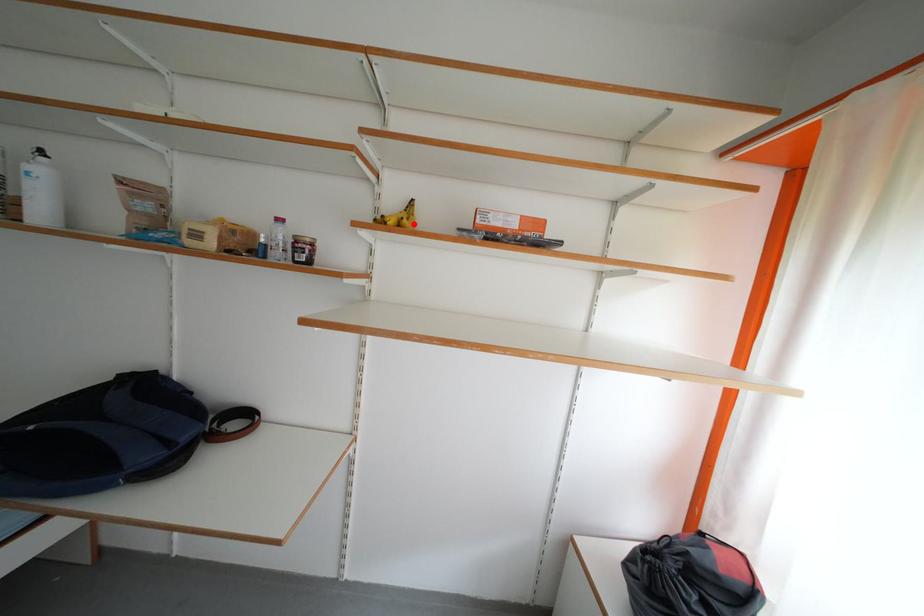
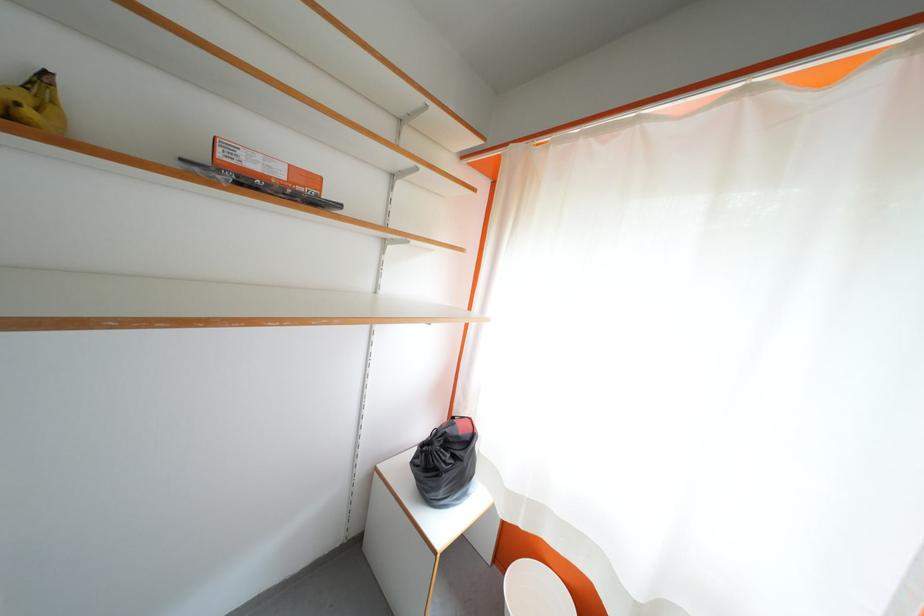
In the second image, find the point that corresponds to the highlighted location in the first image.

(38, 115)